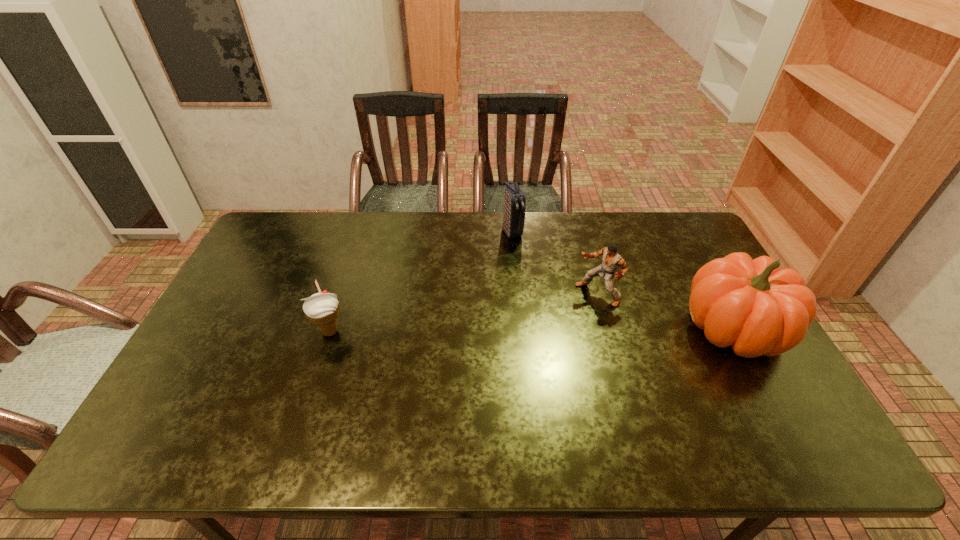
Locate an element on the screen. The width and height of the screenshot is (960, 540). free space at the far left corner of the desktop is located at coordinates (286, 240).

Locate an element on the screen. vacant space at the near right corner of the desktop is located at coordinates 730,386.

Locate an element on the screen. free space between the puncher and the rightmost object is located at coordinates (665, 311).

This screenshot has width=960, height=540. I want to click on vacant space that's between the icecream and the third object from right to left, so click(421, 281).

Image resolution: width=960 pixels, height=540 pixels. I want to click on vacant space in between the second object from right to left and the farthest object, so click(555, 263).

The image size is (960, 540). I want to click on vacant area that lies between the second object from right to left and the clutch bag, so click(x=555, y=263).

Image resolution: width=960 pixels, height=540 pixels. I want to click on free spot between the third object from left to right and the rightmost object, so click(x=665, y=311).

Identify the location of vacant space in between the second object from left to right and the puncher. (555, 263).

This screenshot has height=540, width=960. Identify the location of free space between the pumpkin and the second object from left to right. (623, 280).

Locate an element on the screen. free space between the rightmost object and the second object from right to left is located at coordinates (665, 311).